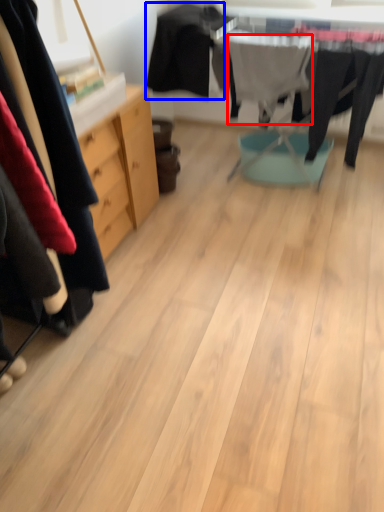
Question: Which object is closer to the camera taking this photo, clothing (highlighted by a red box) or clothing (highlighted by a blue box)?

Choices:
 (A) clothing
 (B) clothing

Answer: (A)